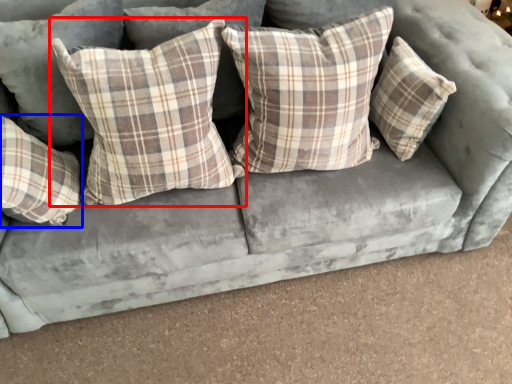
Question: Which point is closer to the camera, pillow (highlighted by a red box) or pillow (highlighted by a blue box)?

Choices:
 (A) pillow
 (B) pillow

Answer: (A)